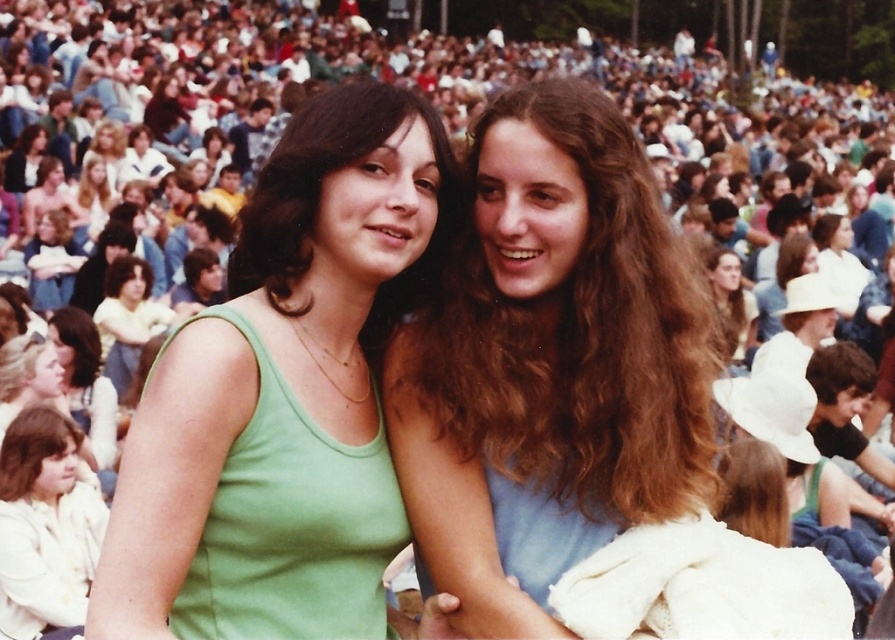
Is the position of green fabric tank top at center less distant than that of yellow fabric shirt at center?

Yes, it is in front of yellow fabric shirt at center.

Is point (376, 106) farther from camera compared to point (124, 339)?

No, it is in front of (124, 339).

Who is more forward, (330, 163) or (134, 269)?

Point (330, 163)

Identify the location of green fabric tank top at center. The height and width of the screenshot is (640, 895). (320, 195).

Can you confirm if green matte tank top at center is positioned below brown hair at upper center?

Correct, green matte tank top at center is located below brown hair at upper center.

Can you confirm if green matte tank top at center is positioned to the right of brown hair at upper center?

Incorrect, green matte tank top at center is not on the right side of brown hair at upper center.

Is point (371, 483) positioned before point (716, 268)?

Yes, point (371, 483) is closer to viewer.

At what (x,y) coordinates should I click in order to perform the action: click on green matte tank top at center. Please return your answer as a coordinate pair (x, y). The image size is (895, 640). Looking at the image, I should click on (284, 394).

Is green matte tank top at center smaller than yellow fabric shirt at center?

Correct, green matte tank top at center occupies less space than yellow fabric shirt at center.

Can you confirm if green matte tank top at center is shorter than yellow fabric shirt at center?

Indeed, green matte tank top at center has a lesser height compared to yellow fabric shirt at center.

Who is more forward, (378,513) or (148,320)?

Point (378,513) is in front.

This screenshot has width=895, height=640. I want to click on green matte tank top at center, so click(x=284, y=394).